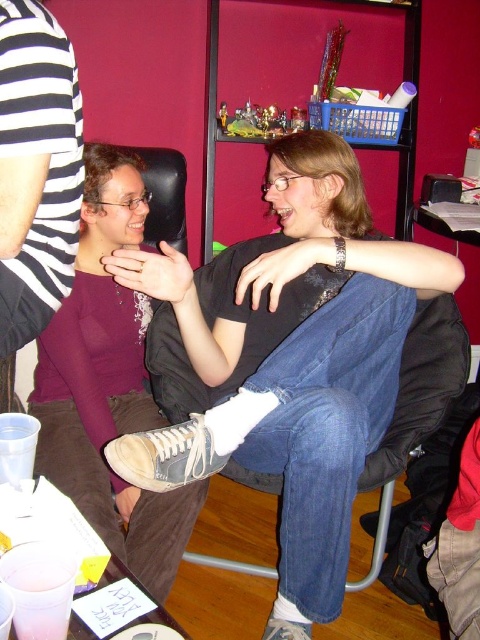
Can you confirm if denim jeans at center is positioned to the left of matte purple sweater at center?

Incorrect, denim jeans at center is not on the left side of matte purple sweater at center.

The height and width of the screenshot is (640, 480). What do you see at coordinates (289, 362) in the screenshot? I see `denim jeans at center` at bounding box center [289, 362].

Locate an element on the screen. This screenshot has height=640, width=480. denim jeans at center is located at coordinates (289, 362).